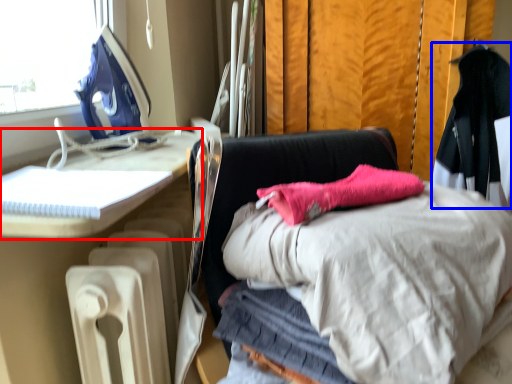
Question: Among these objects, which one is farthest to the camera, furniture (highlighted by a red box) or clothing (highlighted by a blue box)?

Choices:
 (A) furniture
 (B) clothing

Answer: (B)